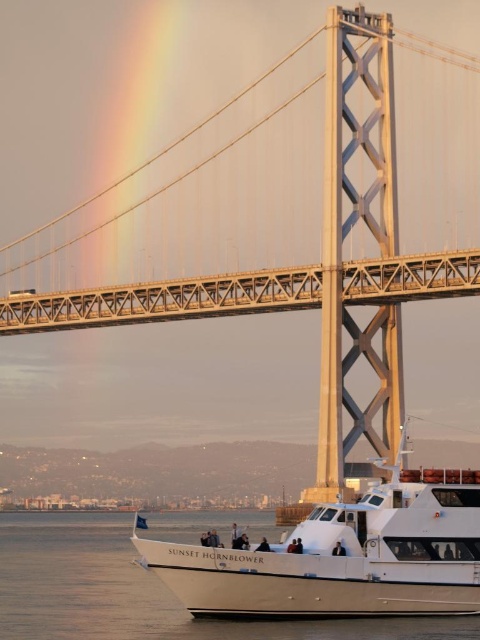
Question: From the image, what is the correct spatial relationship of white matte boat at lower right in relation to white smooth water at lower center?

Choices:
 (A) below
 (B) above

Answer: (B)

Question: Among these points, which one is nearest to the camera?

Choices:
 (A) (57, 570)
 (B) (408, 604)

Answer: (B)

Question: Which object is closer to the camera taking this photo?

Choices:
 (A) white smooth water at lower center
 (B) white matte boat at lower right

Answer: (A)

Question: Observing the image, what is the correct spatial positioning of white matte boat at lower right in reference to white smooth water at lower center?

Choices:
 (A) below
 (B) above

Answer: (B)

Question: Which object appears closest to the camera in this image?

Choices:
 (A) white matte boat at lower right
 (B) white smooth water at lower center

Answer: (B)

Question: Is white matte boat at lower right in front of white smooth water at lower center?

Choices:
 (A) yes
 (B) no

Answer: (B)